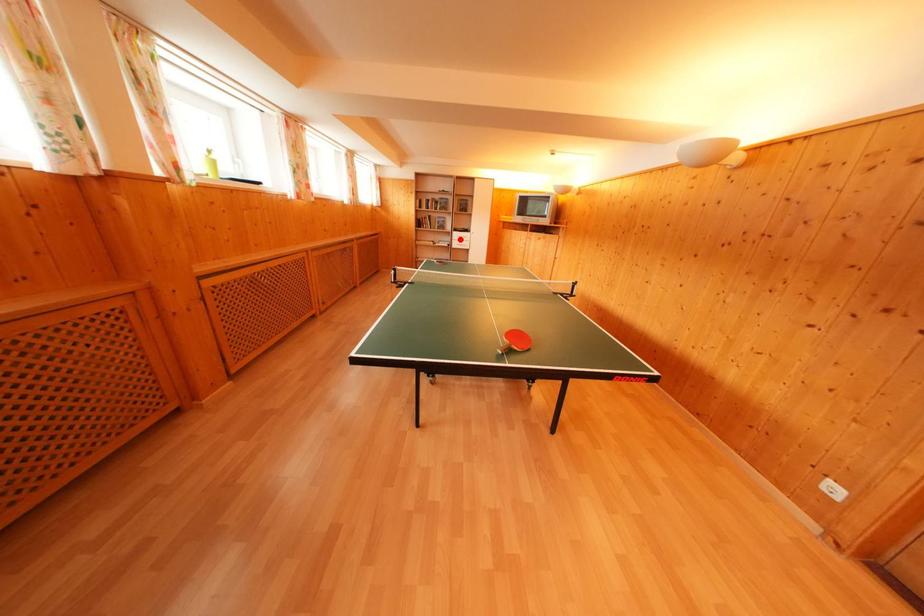
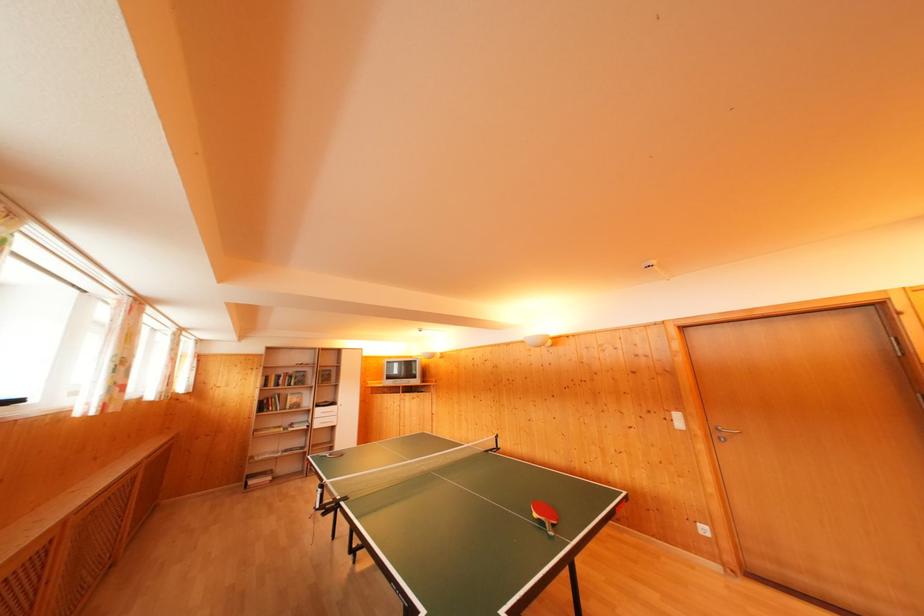
Question: I am providing you with two images of the same scene from different viewpoints. A red point is shown in image1. For the corresponding object point in image2, is it positioned nearer or farther from the camera?

Choices:
 (A) Nearer
 (B) Farther

Answer: (B)